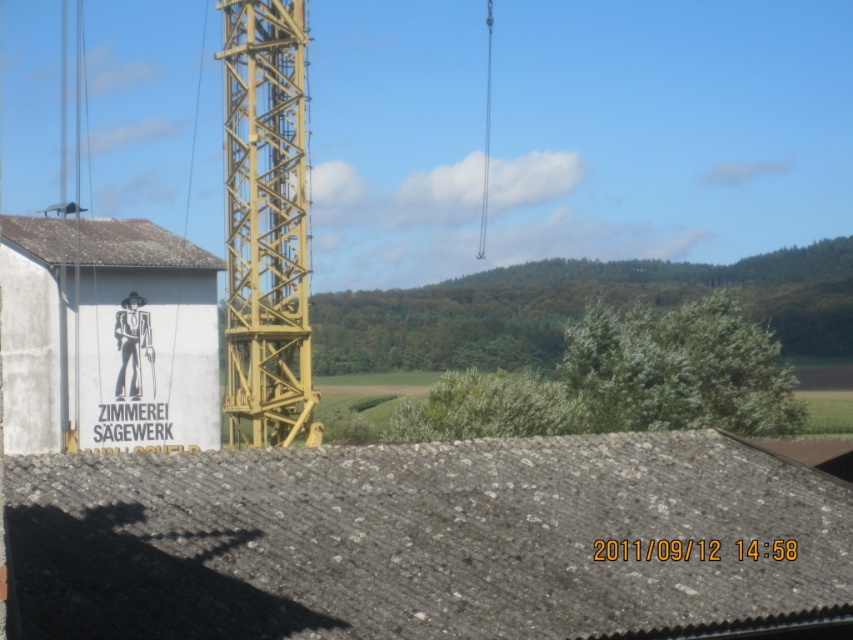
Looking at this image, you are a delivery truck driver who needs to pass through the area between the yellow metallic crane at center and the black matte figure at center. The truck is 3 meters wide. Can you safely navigate through this space?

The yellow metallic crane at center might be wider than black matte figure at center. Since the truck is 3 meters wide, it is uncertain if there is enough space between them. You should measure the width before proceeding to ensure safety.

From the picture: You are standing at the point with coordinates point (166,266) and want to walk to the point with coordinates point (234,467). Which direction should you move in to reach your destination?

You should move forward because point (234,467) is in front of point (166,266).

You are a construction worker who needs to lift a heavy beam using the yellow metallic crane at center. However, the black matte figure at center is standing nearby. Can the crane safely lift the beam without hitting the figure?

The yellow metallic crane at center is larger in size compared to the black matte figure at center, so there should be enough clearance to safely lift the beam without hitting the figure.